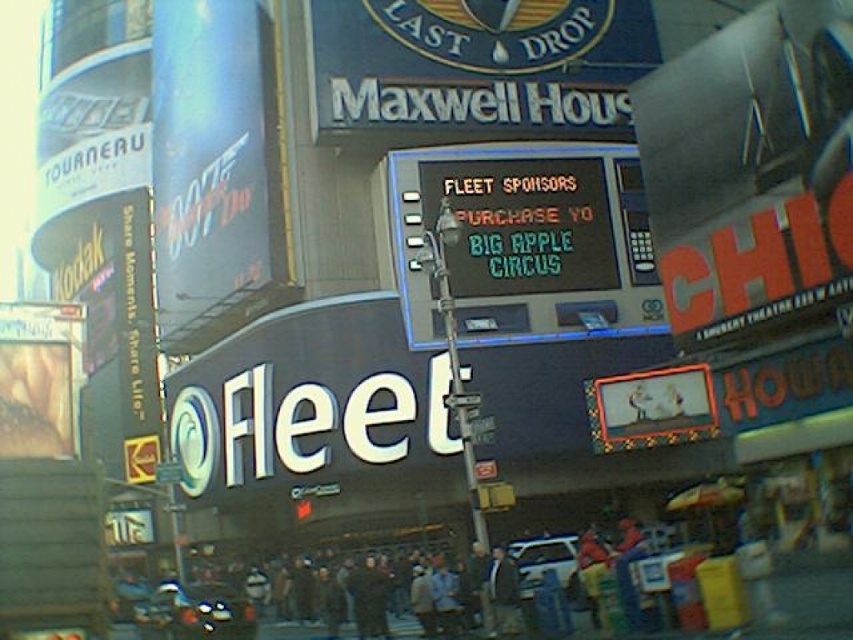
Question: Which point is farther to the camera?

Choices:
 (A) dark gray jacket at center
 (B) white matte car at center
 (C) shiny black motorcycle at lower left
 (D) black digital sign at center

Answer: (D)

Question: Which object is the farthest from the black digital sign at center?

Choices:
 (A) dark gray jacket at center
 (B) shiny black motorcycle at lower left

Answer: (B)

Question: Can you confirm if shiny black motorcycle at lower left is positioned below dark gray jacket at center?

Choices:
 (A) yes
 (B) no

Answer: (A)

Question: Is shiny black motorcycle at lower left smaller than dark gray jacket at center?

Choices:
 (A) no
 (B) yes

Answer: (A)

Question: Which object appears closest to the camera in this image?

Choices:
 (A) shiny black motorcycle at lower left
 (B) black digital sign at center

Answer: (A)

Question: Considering the relative positions of shiny black motorcycle at lower left and white matte car at center in the image provided, where is shiny black motorcycle at lower left located with respect to white matte car at center?

Choices:
 (A) right
 (B) left

Answer: (B)